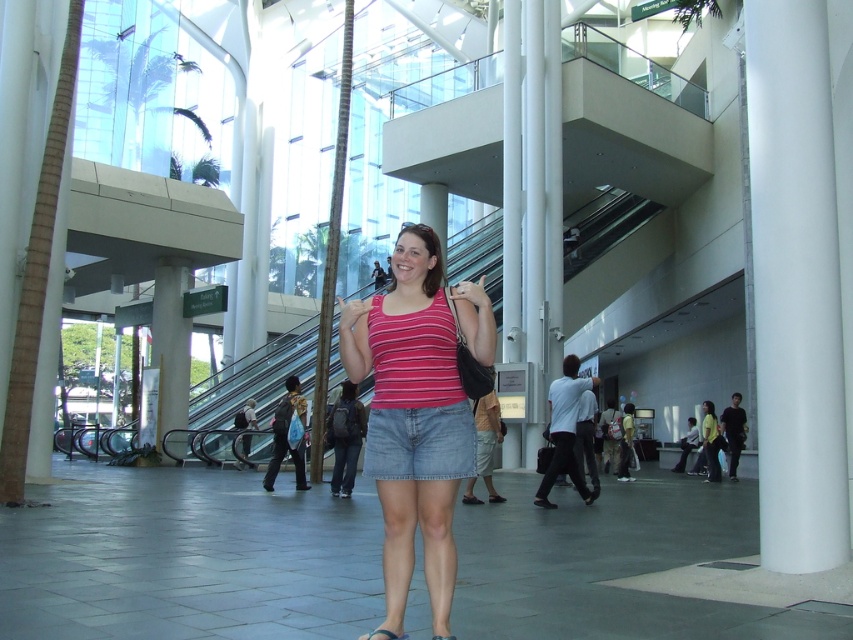
How much distance is there between white smooth column at right and metallic silver escalator at center?

The distance of white smooth column at right from metallic silver escalator at center is 17.86 meters.

Which of these two, white smooth column at right or metallic silver escalator at center, stands taller?

Standing taller between the two is metallic silver escalator at center.

Describe the element at coordinates (795, 289) in the screenshot. This screenshot has height=640, width=853. I see `white smooth column at right` at that location.

The image size is (853, 640). In order to click on white smooth column at right in this screenshot , I will do 795,289.

Is denim shorts at center thinner than white cotton shirt at center?

Correct, denim shorts at center's width is less than white cotton shirt at center's.

Is point (427, 417) farther from viewer compared to point (552, 472)?

No.

Describe the element at coordinates (421, 444) in the screenshot. I see `denim shorts at center` at that location.

At what (x,y) coordinates should I click in order to perform the action: click on denim shorts at center. Please return your answer as a coordinate pair (x, y). The height and width of the screenshot is (640, 853). Looking at the image, I should click on (421, 444).

Can you confirm if white cotton shirt at center is positioned to the left of leather-like brown sandal at lower center?

In fact, white cotton shirt at center is to the right of leather-like brown sandal at lower center.

Does white cotton shirt at center appear over leather-like brown sandal at lower center?

Incorrect, white cotton shirt at center is not positioned above leather-like brown sandal at lower center.

I want to click on white cotton shirt at center, so click(x=566, y=432).